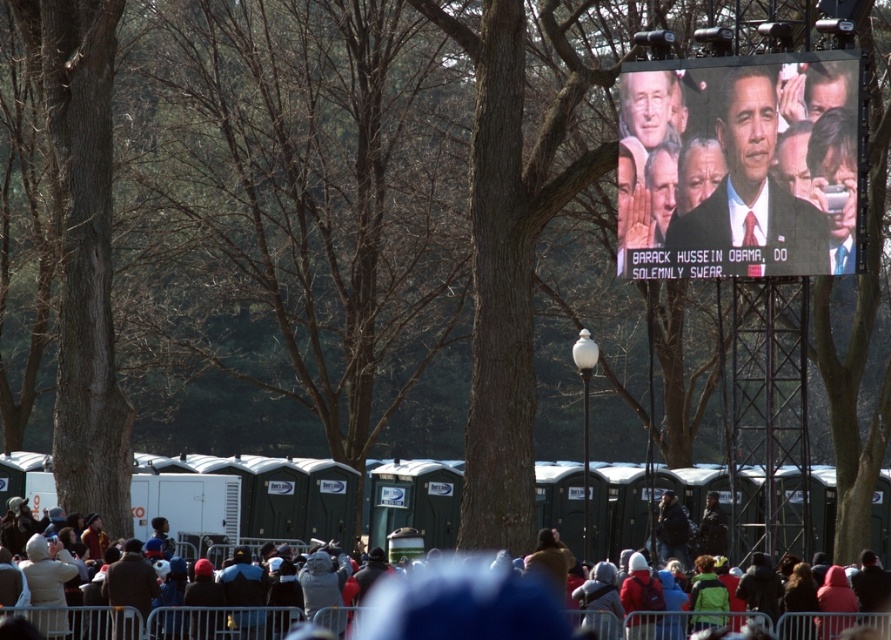
Which is below, matte black screen at upper center or dark gray fabric crowd at lower center?

dark gray fabric crowd at lower center

Who is more forward, (684,72) or (225,614)?

Point (225,614) is more forward.

Is point (685, 250) farther from viewer compared to point (60, 630)?

Yes, point (685, 250) is behind point (60, 630).

At what (x,y) coordinates should I click in order to perform the action: click on matte black screen at upper center. Please return your answer as a coordinate pair (x, y). Looking at the image, I should click on tap(737, 166).